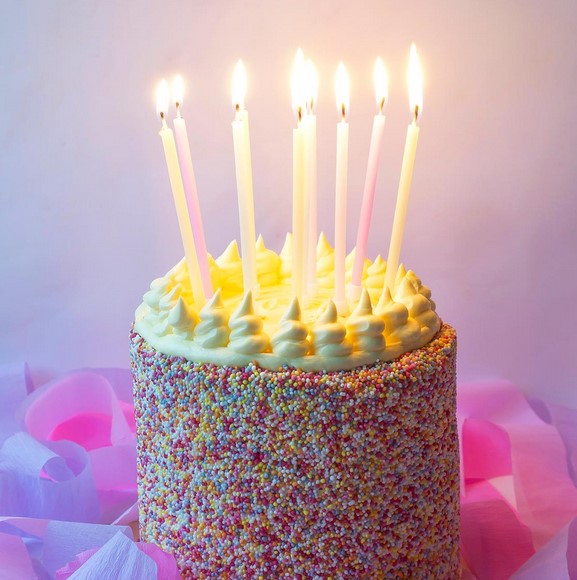
This screenshot has height=580, width=577. Find the location of `candle flames`. candle flames is located at coordinates (160, 105), (173, 92), (241, 95), (236, 101), (295, 97), (314, 84), (349, 96), (385, 90), (415, 94).